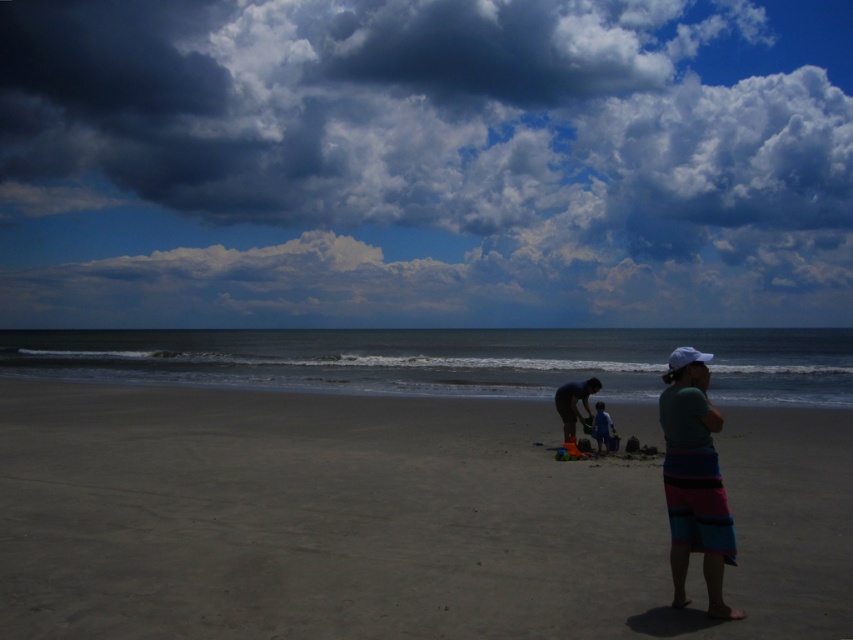
Question: Estimate the real-world distances between objects in this image. Which object is farther from the smooth sand at center?

Choices:
 (A) dark gray cloud at upper center
 (B) matte black surfboard at lower center
 (C) striped towel at right

Answer: (A)

Question: Can you confirm if dark gray cloud at upper center is positioned above striped towel at right?

Choices:
 (A) no
 (B) yes

Answer: (B)

Question: Can you confirm if striped towel at right is positioned to the left of matte black surfboard at lower center?

Choices:
 (A) no
 (B) yes

Answer: (B)

Question: Does matte black surfboard at lower center appear on the right side of blue fabric pants at center?

Choices:
 (A) no
 (B) yes

Answer: (A)

Question: Which of the following is the closest to the observer?

Choices:
 (A) (302, 474)
 (B) (830, 109)

Answer: (A)

Question: Which of these objects is positioned closest to the blue fabric pants at center?

Choices:
 (A) matte black surfboard at lower center
 (B) smooth sand at center
 (C) striped towel at right
 (D) dark gray cloud at upper center

Answer: (A)